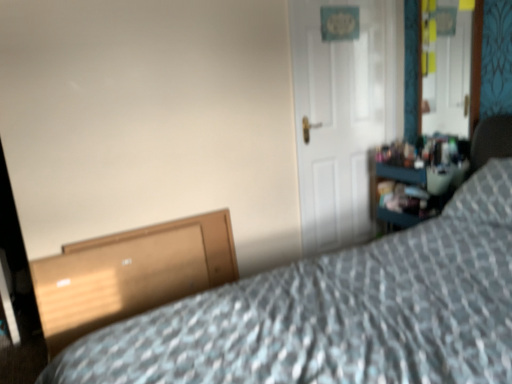
Locate an element on the screen. This screenshot has width=512, height=384. free space above white matte door at center (from a real-world perspective) is located at coordinates (338, 1).